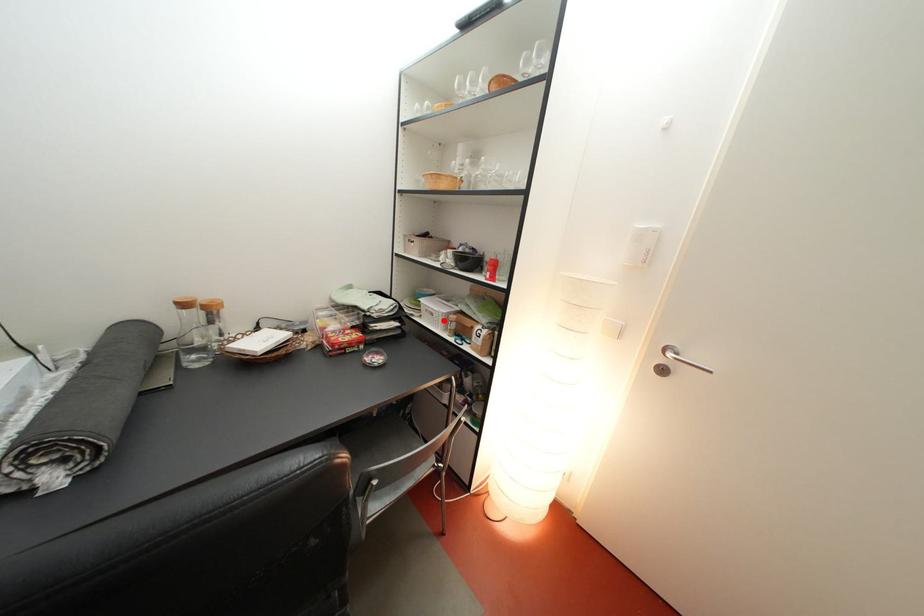
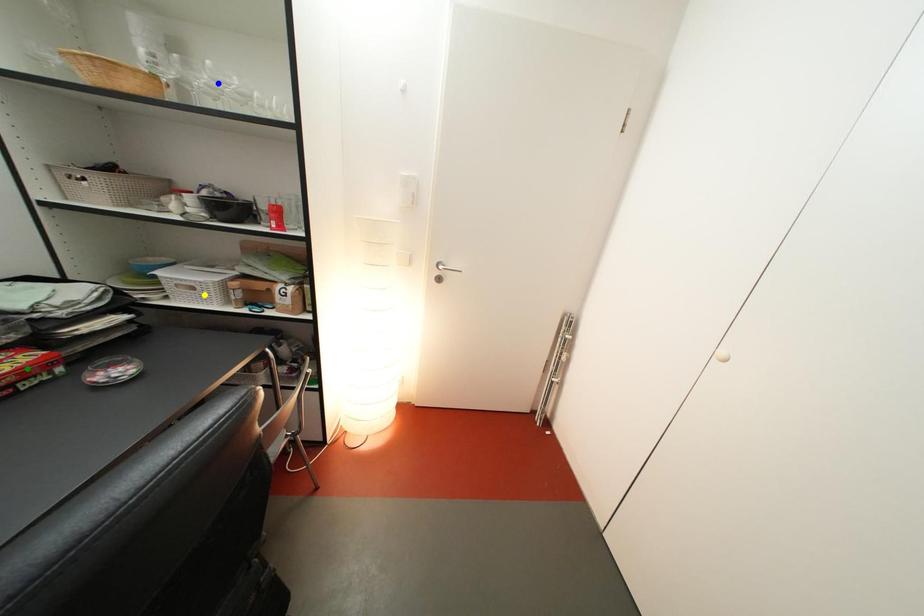
Question: I am providing you with two images of the same scene from different viewpoints. A red point is marked on the first image. You are given multiple points on the second image. Can you choose the point in image 2 that corresponds to the point in image 1?

Choices:
 (A) yellow point
 (B) blue point
 (C) green point

Answer: (A)